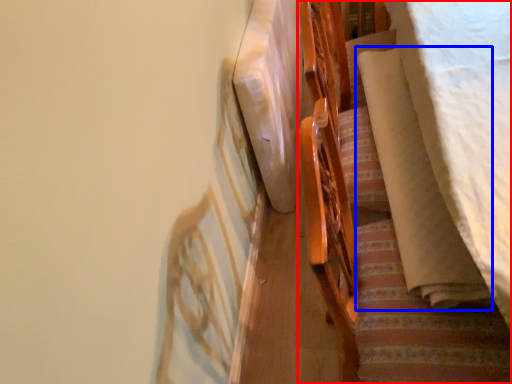
Question: Which object is closer to the camera taking this photo, furniture (highlighted by a red box) or blanket (highlighted by a blue box)?

Choices:
 (A) furniture
 (B) blanket

Answer: (A)